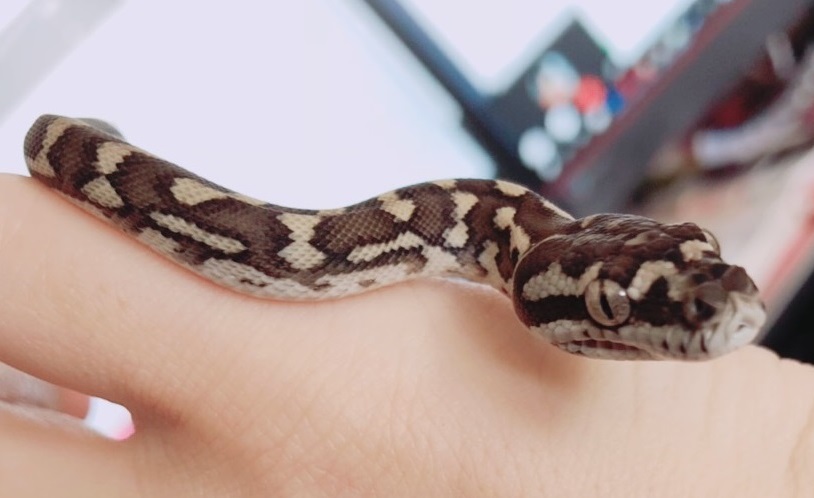
Find the location of a particular element. The image size is (814, 498). computer screen is located at coordinates (466, 40).